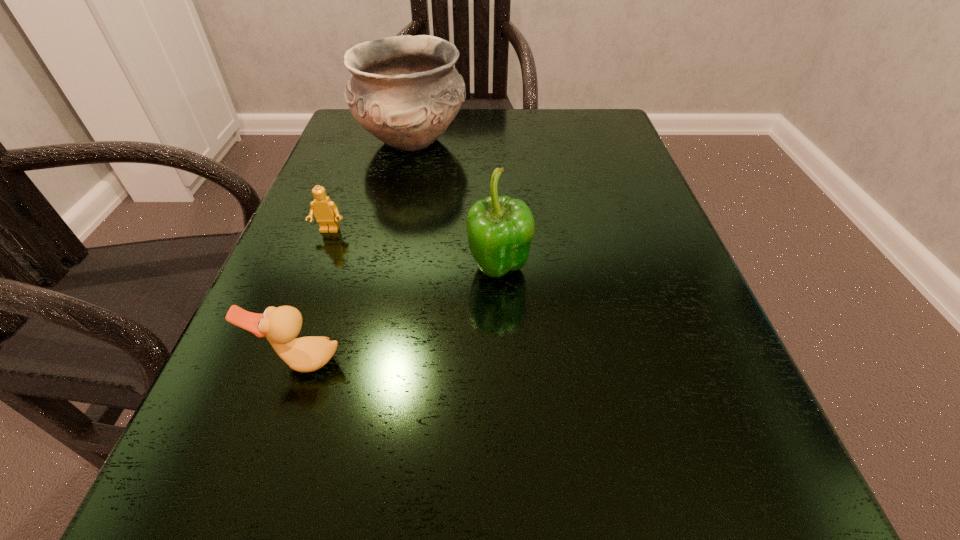
Locate an element on the screen. Image resolution: width=960 pixels, height=540 pixels. free space between the pottery and the nearest object is located at coordinates tap(356, 252).

Select which object is the third closest to the pottery. Please provide its 2D coordinates. Your answer should be formatted as a tuple, i.e. [(x, y)], where the tuple contains the x and y coordinates of a point satisfying the conditions above.

[(281, 325)]

Select which object appears as the third closest to the pottery. Please provide its 2D coordinates. Your answer should be formatted as a tuple, i.e. [(x, y)], where the tuple contains the x and y coordinates of a point satisfying the conditions above.

[(281, 325)]

Identify the location of free space in the image that satisfies the following two spatial constraints: 1. on the front side of the third farthest object; 2. on the left side of the farthest object. (383, 269).

Where is `free space that satisfies the following two spatial constraints: 1. on the front side of the bell pepper; 2. on the left side of the pottery`? The height and width of the screenshot is (540, 960). free space that satisfies the following two spatial constraints: 1. on the front side of the bell pepper; 2. on the left side of the pottery is located at coordinates (383, 269).